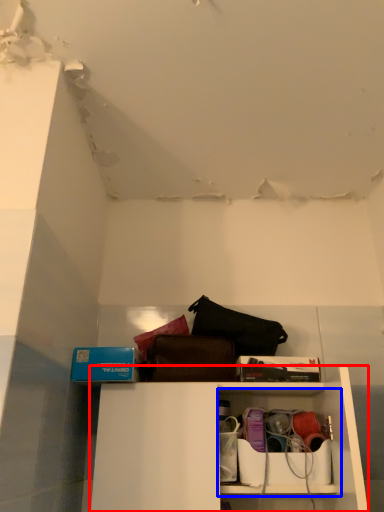
Question: Among these objects, which one is nearest to the camera, shelf (highlighted by a red box) or cabinet (highlighted by a blue box)?

Choices:
 (A) shelf
 (B) cabinet

Answer: (A)